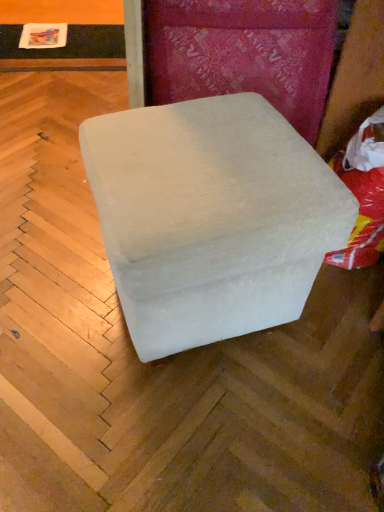
Question: Considering the relative sizes of white fabric bean bag at right and white fabric ottoman at center in the image provided, is white fabric bean bag at right smaller than white fabric ottoman at center?

Choices:
 (A) no
 (B) yes

Answer: (B)

Question: Is white fabric bean bag at right taller than white fabric ottoman at center?

Choices:
 (A) no
 (B) yes

Answer: (A)

Question: Does white fabric bean bag at right have a larger size compared to white fabric ottoman at center?

Choices:
 (A) no
 (B) yes

Answer: (A)

Question: Are white fabric bean bag at right and white fabric ottoman at center far apart?

Choices:
 (A) no
 (B) yes

Answer: (A)

Question: Considering the relative positions of white fabric bean bag at right and white fabric ottoman at center in the image provided, is white fabric bean bag at right in front of white fabric ottoman at center?

Choices:
 (A) no
 (B) yes

Answer: (A)

Question: Does white fabric bean bag at right have a lesser width compared to white fabric ottoman at center?

Choices:
 (A) yes
 (B) no

Answer: (A)

Question: Is white fabric ottoman at center shorter than white fabric bean bag at right?

Choices:
 (A) no
 (B) yes

Answer: (A)

Question: From a real-world perspective, is white fabric ottoman at center located beneath white fabric bean bag at right?

Choices:
 (A) yes
 (B) no

Answer: (B)

Question: Could white fabric bean bag at right be considered to be inside white fabric ottoman at center?

Choices:
 (A) yes
 (B) no

Answer: (B)

Question: Does white fabric ottoman at center have a lesser width compared to white fabric bean bag at right?

Choices:
 (A) yes
 (B) no

Answer: (B)

Question: Can you confirm if white fabric ottoman at center is smaller than white fabric bean bag at right?

Choices:
 (A) no
 (B) yes

Answer: (A)

Question: Is white fabric ottoman at center facing away from white fabric bean bag at right?

Choices:
 (A) yes
 (B) no

Answer: (A)

Question: Is white fabric ottoman at center taller or shorter than white fabric bean bag at right?

Choices:
 (A) short
 (B) tall

Answer: (B)